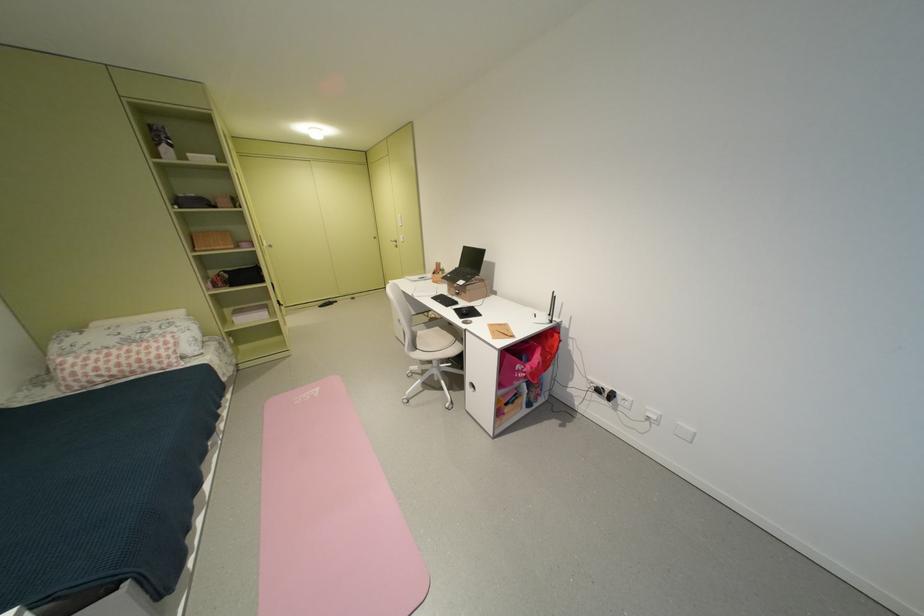
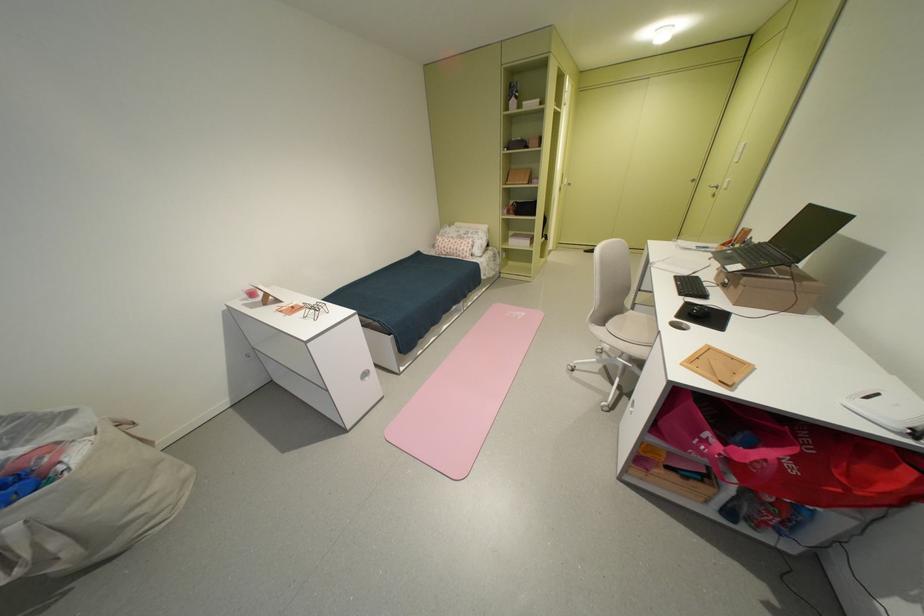
The point at (475,294) is marked in the first image. Where is the corresponding point in the second image?

(746, 288)